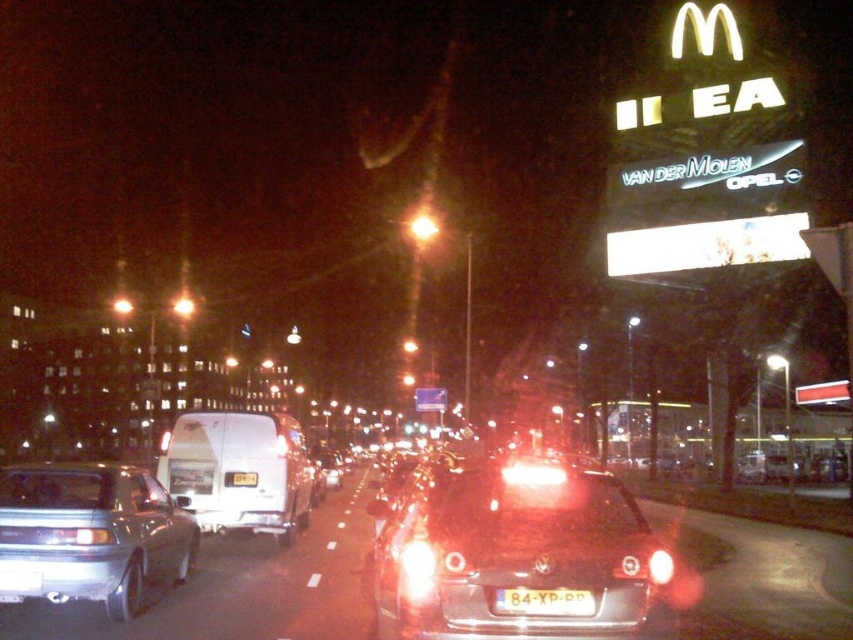
Looking at this image, who is more forward, (508,604) or (241,477)?

Point (508,604) is more forward.

Image resolution: width=853 pixels, height=640 pixels. In order to click on white plastic license plate at center in this screenshot , I will do `click(544, 602)`.

Which is in front, point (534, 605) or point (244, 484)?

Point (534, 605)

The image size is (853, 640). I want to click on white plastic license plate at center, so click(544, 602).

Looking at this image, does white matte van at center have a greater width compared to matte red headlight at center?

Correct, the width of white matte van at center exceeds that of matte red headlight at center.

Image resolution: width=853 pixels, height=640 pixels. I want to click on white matte van at center, so click(x=239, y=470).

Between point (552, 536) and point (581, 593), which one is positioned behind?

The point (552, 536) is more distant.

Does glossy plastic car at center have a greater width compared to white plastic license plate at center?

Yes, glossy plastic car at center is wider than white plastic license plate at center.

At what (x,y) coordinates should I click in order to perform the action: click on glossy plastic car at center. Please return your answer as a coordinate pair (x, y). This screenshot has height=640, width=853. Looking at the image, I should click on (515, 556).